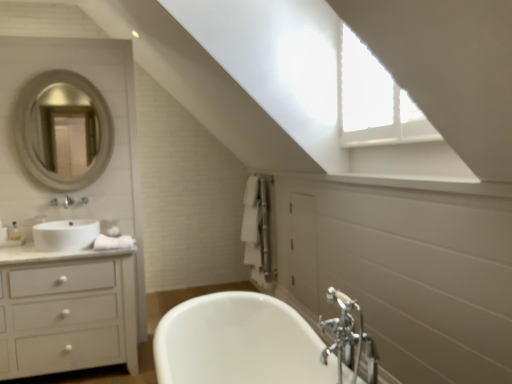
Locate an element on the screen. This screenshot has width=512, height=384. free spot above silver metallic mirror at upper left (from a real-world perspective) is located at coordinates (67, 67).